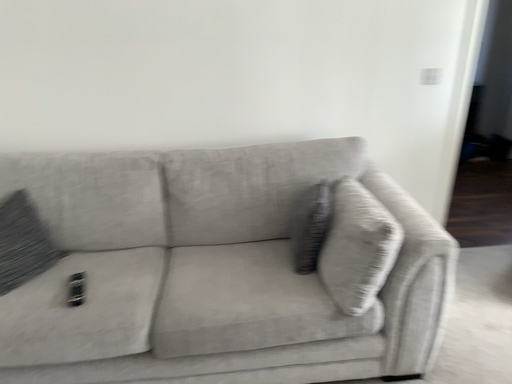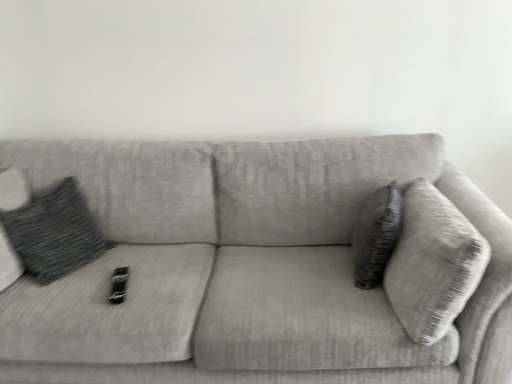
Question: Which way did the camera rotate in the video?

Choices:
 (A) rotated right
 (B) rotated left

Answer: (B)